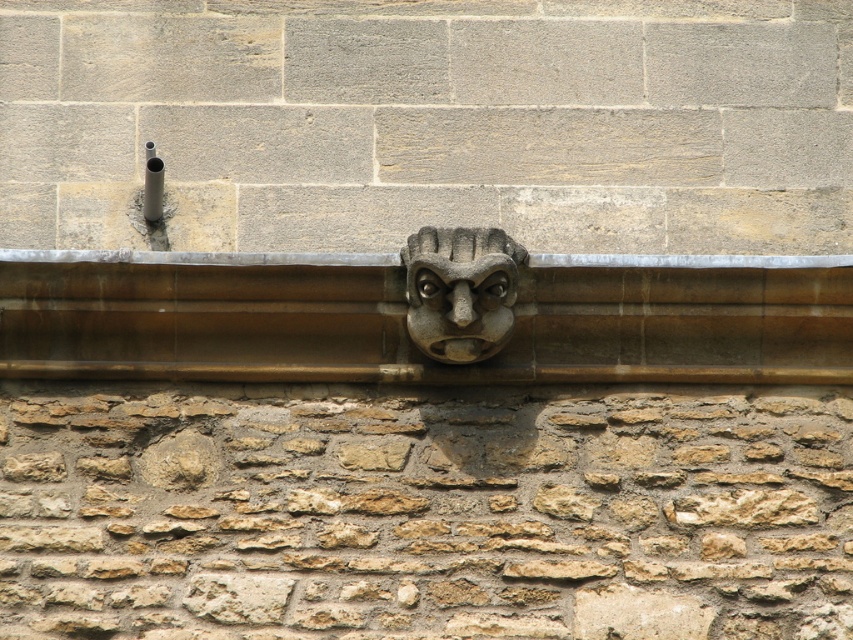
Does brown rough stone at center appear under stone carved face at center?

Correct, brown rough stone at center is located below stone carved face at center.

Between brown rough stone at center and stone carved face at center, which one has less height?

With less height is stone carved face at center.

What do you see at coordinates (422, 513) in the screenshot? I see `brown rough stone at center` at bounding box center [422, 513].

Where is `brown rough stone at center`? This screenshot has height=640, width=853. brown rough stone at center is located at coordinates (422, 513).

Between brown stone ledge at center and stone carved face at center, which one is positioned higher?

brown stone ledge at center

Does brown stone ledge at center have a smaller size compared to stone carved face at center?

Actually, brown stone ledge at center might be larger than stone carved face at center.

Identify the location of brown stone ledge at center. (412, 317).

Measure the distance from brown rough stone at center to brown stone ledge at center.

brown rough stone at center is 1.99 meters away from brown stone ledge at center.

Between point (816, 628) and point (646, 372), which one is positioned behind?

The point (646, 372) is more distant.

Measure the distance between point (579,545) and camera.

Point (579,545) and camera are 46.58 meters apart from each other.

The image size is (853, 640). I want to click on brown rough stone at center, so click(422, 513).